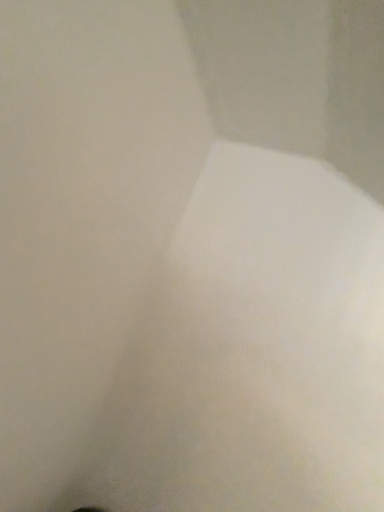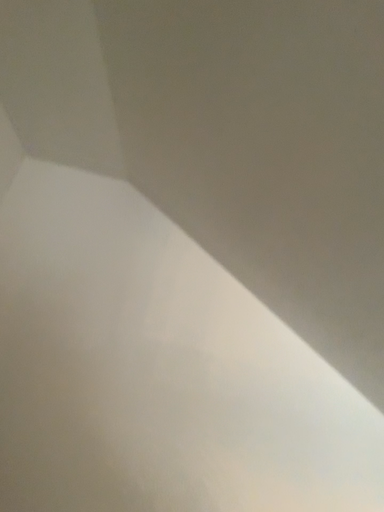
Question: How did the camera likely rotate when shooting the video?

Choices:
 (A) rotated right
 (B) rotated left

Answer: (A)